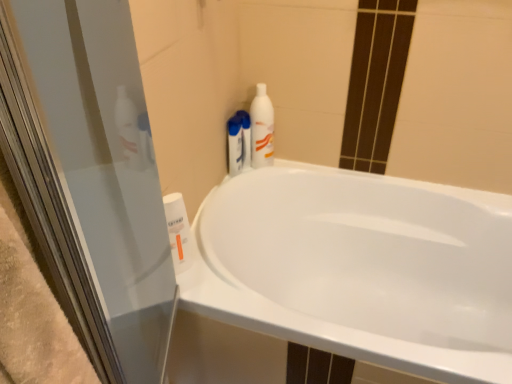
Locate an element on the screen. The height and width of the screenshot is (384, 512). free space in front of white glossy bottle at upper right, the first cleaning product viewed from the right is located at coordinates click(251, 182).